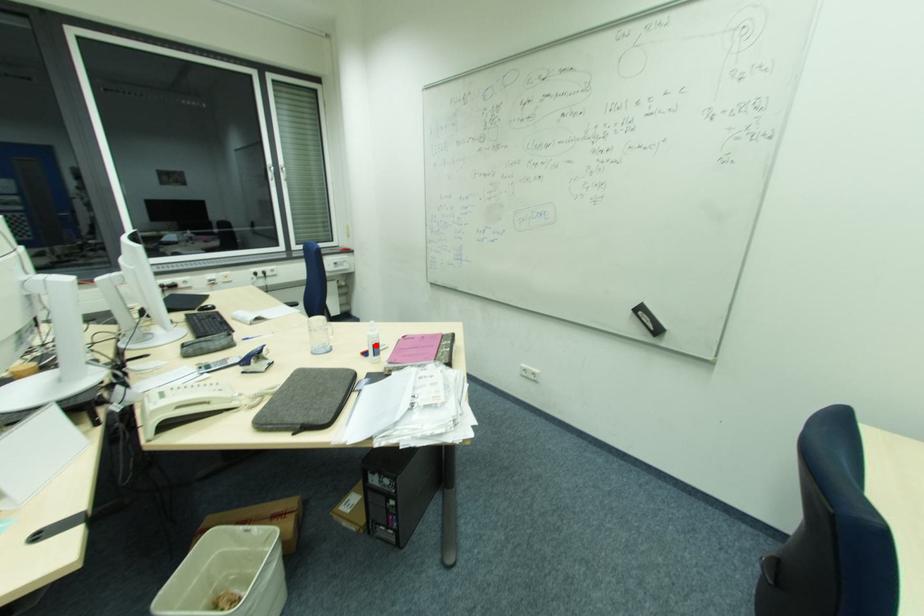
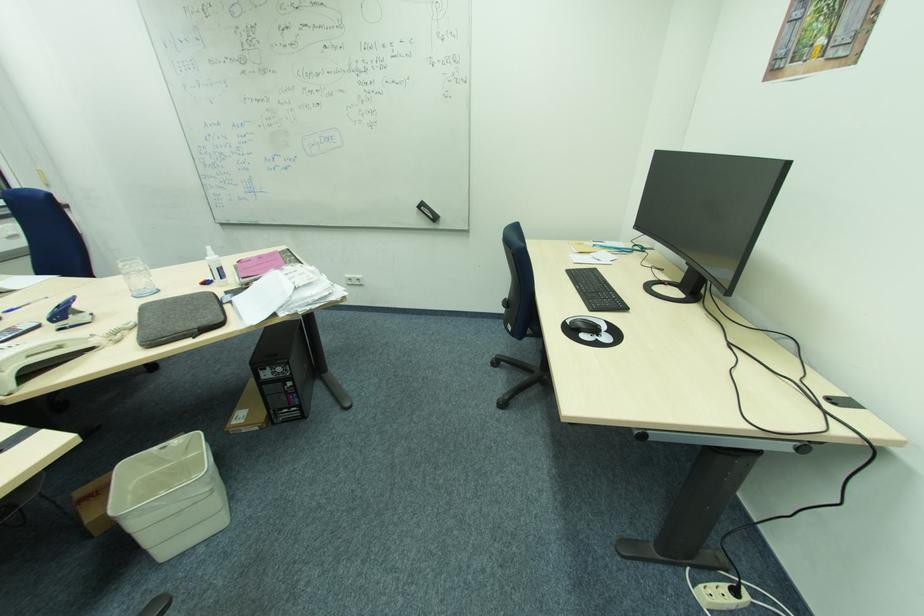
In the second image, find the point that corresponds to the highlighted location in the first image.

(221, 268)